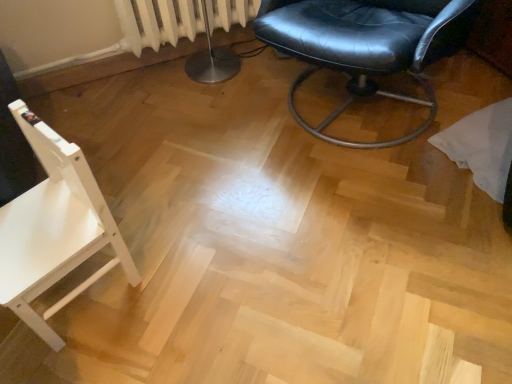
Question: Is white textured radiator at upper left not within white wood chair at left, positioned as the 2th chair in right-to-left order?

Choices:
 (A) no
 (B) yes

Answer: (B)

Question: Is white textured radiator at upper left next to white wood chair at left, arranged as the second chair when viewed from the top, and touching it?

Choices:
 (A) yes
 (B) no

Answer: (B)

Question: Is white textured radiator at upper left thinner than white wood chair at left, the first chair in the bottom-to-top sequence?

Choices:
 (A) yes
 (B) no

Answer: (A)

Question: Is white textured radiator at upper left positioned in front of white wood chair at left, positioned as the 2th chair in right-to-left order?

Choices:
 (A) no
 (B) yes

Answer: (A)

Question: From a real-world perspective, is white textured radiator at upper left physically above white wood chair at left, positioned as the 2th chair in right-to-left order?

Choices:
 (A) yes
 (B) no

Answer: (A)

Question: Considering the relative positions of white textured radiator at upper left and white wood chair at left, the first chair in the bottom-to-top sequence, in the image provided, is white textured radiator at upper left to the right of white wood chair at left, the first chair in the bottom-to-top sequence, from the viewer's perspective?

Choices:
 (A) no
 (B) yes

Answer: (B)

Question: Can you confirm if white wood chair at left, arranged as the second chair when viewed from the top, is shorter than black leather chair at center, the second chair ordered from the bottom?

Choices:
 (A) yes
 (B) no

Answer: (A)

Question: Is black leather chair at center, the second chair ordered from the bottom, located within white wood chair at left, arranged as the second chair when viewed from the top?

Choices:
 (A) yes
 (B) no

Answer: (B)

Question: Can you confirm if white wood chair at left, arranged as the second chair when viewed from the top, is thinner than black leather chair at center, which appears as the 2th chair when viewed from the left?

Choices:
 (A) yes
 (B) no

Answer: (A)

Question: Is the depth of white wood chair at left, the first chair in the bottom-to-top sequence, greater than that of black leather chair at center, which appears as the 2th chair when viewed from the left?

Choices:
 (A) no
 (B) yes

Answer: (A)

Question: Is white wood chair at left, arranged as the second chair when viewed from the top, at the left side of black leather chair at center, the 1th chair when ordered from right to left?

Choices:
 (A) no
 (B) yes

Answer: (B)

Question: From the image's perspective, does white wood chair at left, the first chair in the left-to-right sequence, appear higher than black leather chair at center, the second chair ordered from the bottom?

Choices:
 (A) yes
 (B) no

Answer: (B)

Question: Would you say white wood chair at left, the first chair in the bottom-to-top sequence, is part of black leather chair at center, the 1th chair when ordered from right to left,'s contents?

Choices:
 (A) no
 (B) yes

Answer: (A)